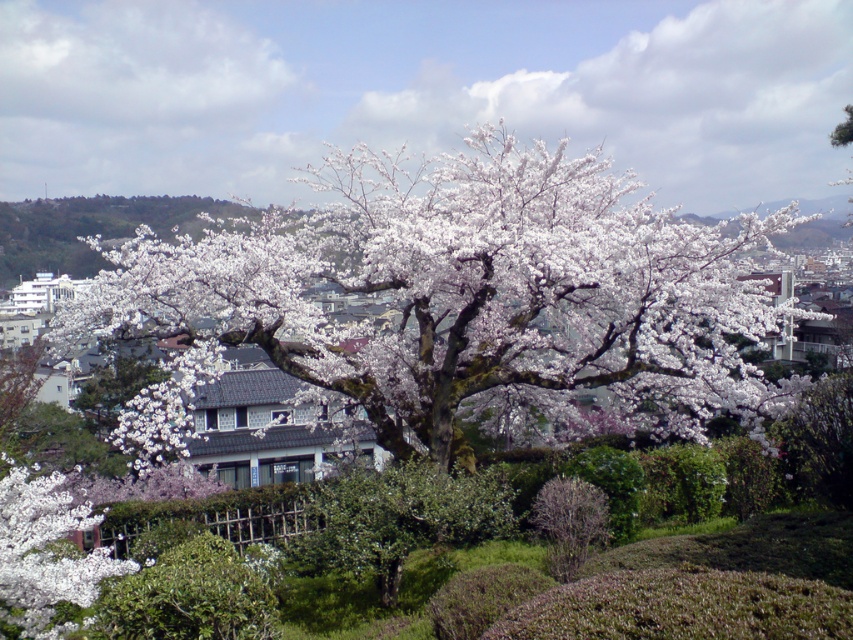
Which is below, green leafy bush at center or bare branches at center?

green leafy bush at center

Can you confirm if green leafy bush at center is positioned to the left of bare branches at center?

Indeed, green leafy bush at center is positioned on the left side of bare branches at center.

You are a GUI agent. You are given a task and a screenshot of the screen. Output one action in this format:
    pyautogui.click(x=<x>, y=<y>)
    Task: Click on the green leafy bush at center
    This screenshot has width=853, height=640.
    Given the screenshot: What is the action you would take?
    pyautogui.click(x=399, y=516)

Does white matte tree at center appear under green leafy bush at center?

Actually, white matte tree at center is above green leafy bush at center.

The width and height of the screenshot is (853, 640). What do you see at coordinates (451, 296) in the screenshot?
I see `white matte tree at center` at bounding box center [451, 296].

Is point (541, 365) in front of point (410, 502)?

No.

Locate an element on the screen. white matte tree at center is located at coordinates click(451, 296).

What do you see at coordinates (451, 296) in the screenshot? This screenshot has width=853, height=640. I see `white matte tree at center` at bounding box center [451, 296].

Which is in front, point (498, 230) or point (553, 504)?

Point (553, 504) is in front.

You are a GUI agent. You are given a task and a screenshot of the screen. Output one action in this format:
    pyautogui.click(x=<x>, y=<y>)
    Task: Click on the white matte tree at center
    This screenshot has height=640, width=853.
    Given the screenshot: What is the action you would take?
    coord(451,296)